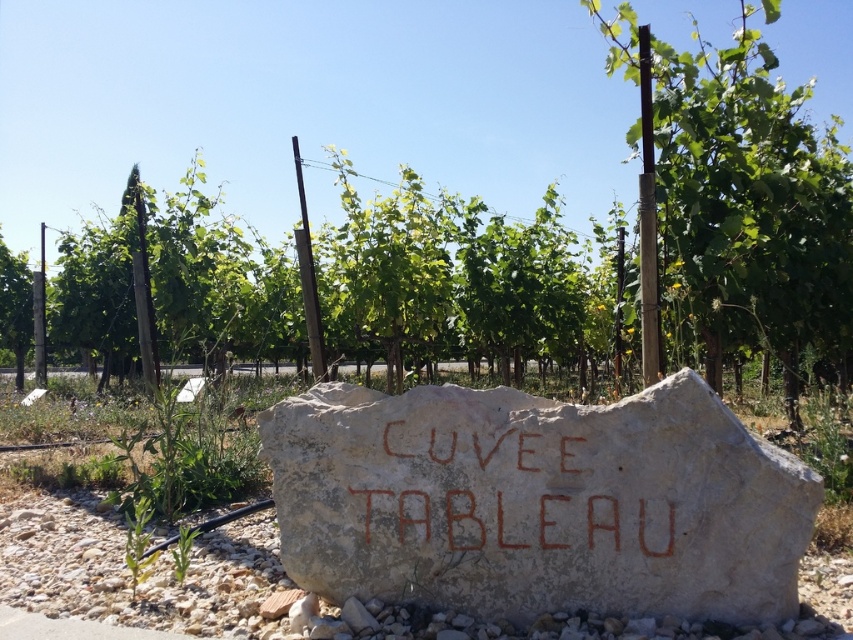
Question: Which object is farther from the camera taking this photo?

Choices:
 (A) white stone boulder at center
 (B) brown carved stone at center

Answer: (B)

Question: Which is farther from the green leafy tree at center?

Choices:
 (A) brown carved stone at center
 (B) white stone boulder at center

Answer: (A)

Question: Does white stone boulder at center appear under brown carved stone at center?

Choices:
 (A) no
 (B) yes

Answer: (A)

Question: Observing the image, what is the correct spatial positioning of white stone boulder at center in reference to brown carved stone at center?

Choices:
 (A) above
 (B) below

Answer: (A)

Question: Is green leafy tree at center further to the viewer compared to brown carved stone at center?

Choices:
 (A) no
 (B) yes

Answer: (B)

Question: Which object is farther from the camera taking this photo?

Choices:
 (A) brown carved stone at center
 (B) green leafy tree at center
 (C) white stone boulder at center

Answer: (B)